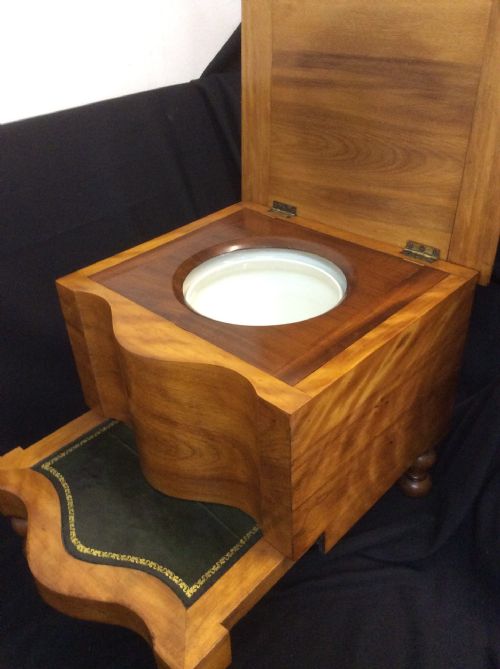
Locate the where you'd sit in the image. Your answer should be formatted as a list of tuples, i.e. [(x1, y1), (x2, y2), ...], where each tuple contains the x and y coordinates of a point satisfying the conditions above.

[(222, 336)]